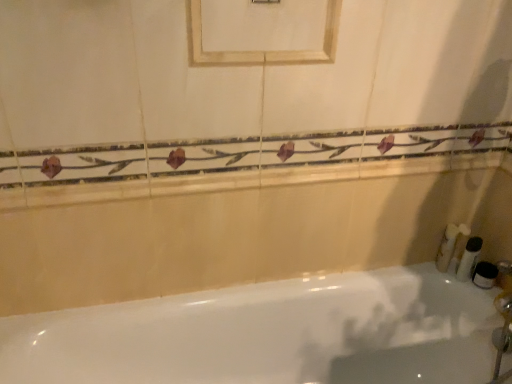
I want to click on vacant space situated on the left part of white fluffy sponge at right, arranged as the 4th toiletry when viewed from the right, so click(410, 272).